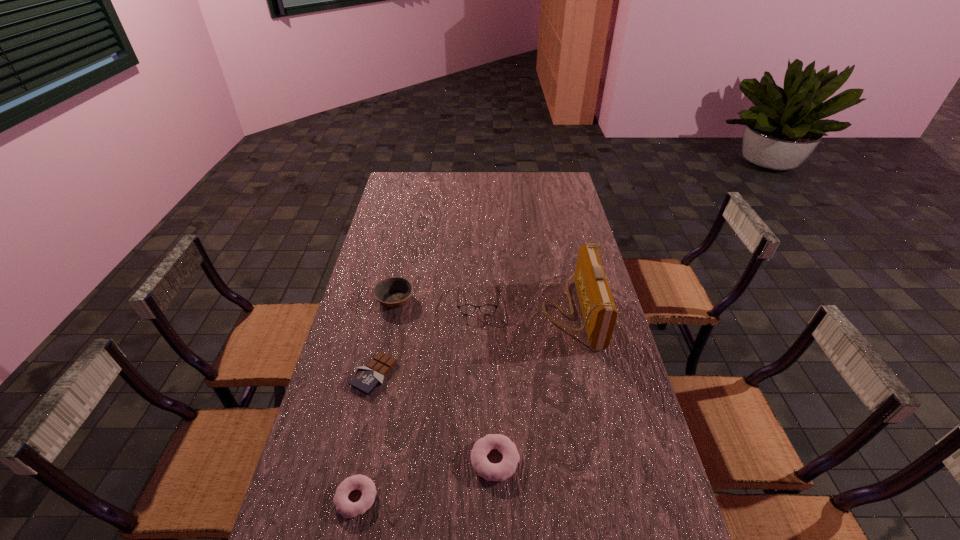
Locate an element on the screen. This screenshot has height=540, width=960. object that is at the right edge is located at coordinates (599, 312).

You are a GUI agent. You are given a task and a screenshot of the screen. Output one action in this format:
    pyautogui.click(x=<x>, y=<y>)
    Task: Click on the object that is at the near left corner
    
    Given the screenshot: What is the action you would take?
    pyautogui.click(x=348, y=509)

In the image, there is a desktop. At what (x,y) coordinates should I click in order to perform the action: click on free space at the far edge. Please return your answer as a coordinate pair (x, y). Image resolution: width=960 pixels, height=540 pixels. Looking at the image, I should click on (531, 174).

I want to click on vacant area at the left edge of the desktop, so click(x=338, y=375).

Where is `vacant region at the right edge of the desktop`? The height and width of the screenshot is (540, 960). vacant region at the right edge of the desktop is located at coordinates (561, 255).

Identify the location of vacant point at the far right corner. (552, 181).

The height and width of the screenshot is (540, 960). What are the coordinates of `free space at the near right corner of the desktop` in the screenshot? It's located at (609, 509).

Image resolution: width=960 pixels, height=540 pixels. Identify the location of vacant point located between the taller doughnut and the spectacles. (487, 381).

At what (x,y) coordinates should I click in order to perform the action: click on vacant space that is in between the spectacles and the shorter doughnut. Please return your answer as a coordinate pair (x, y). This screenshot has height=540, width=960. Looking at the image, I should click on (417, 400).

Locate an element on the screen. vacant area that lies between the third shortest object and the rightmost object is located at coordinates (535, 385).